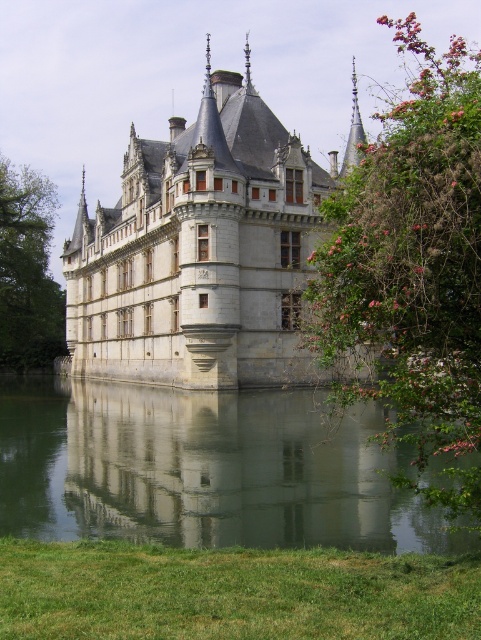
Can you confirm if gray stone castle at center is positioned to the left of transparent glass water at lower center?

In fact, gray stone castle at center is to the right of transparent glass water at lower center.

Who is lower down, gray stone castle at center or transparent glass water at lower center?

transparent glass water at lower center is below.

Identify the location of gray stone castle at center. This screenshot has height=640, width=481. (202, 250).